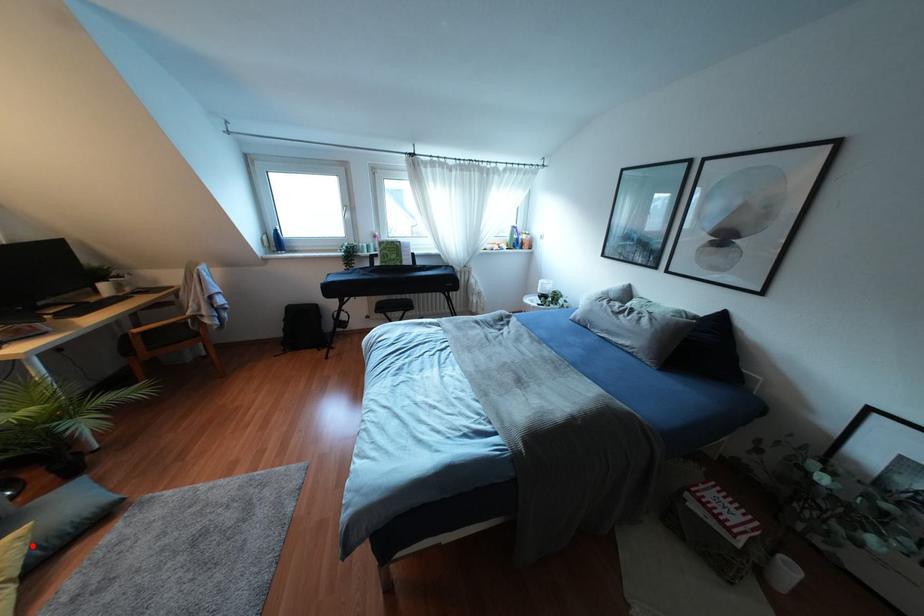
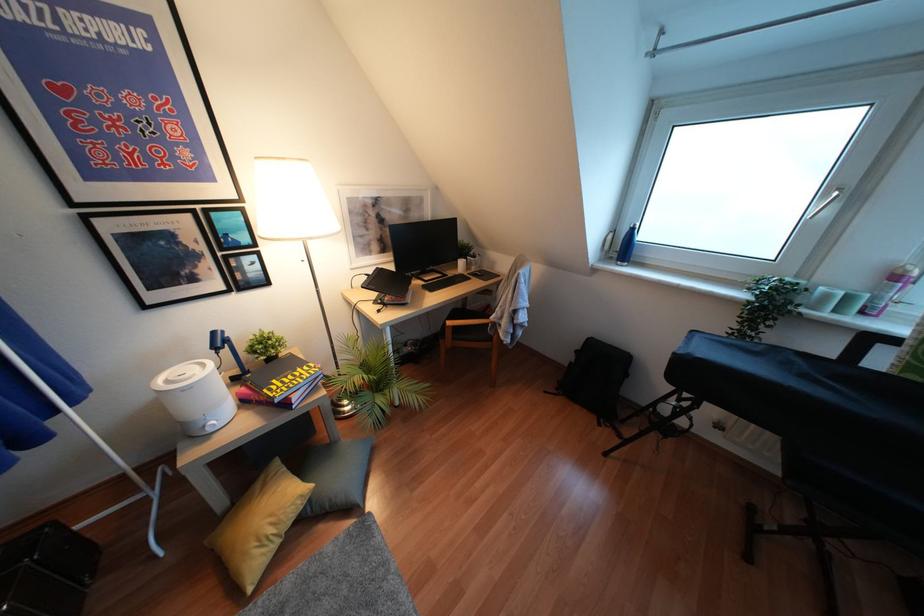
Question: I am providing you with two images of the same scene from different viewpoints. In image1, a red point is highlighted. Considering the same 3D point in image2, which of the following is correct?

Choices:
 (A) It is closer
 (B) It is farther

Answer: (B)